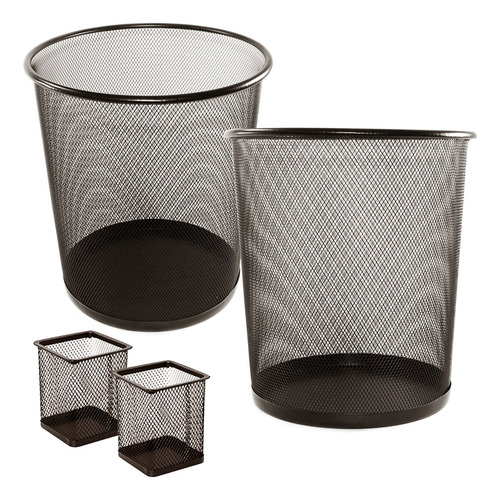
The image size is (500, 500). In order to click on trash cans in this screenshot , I will do pos(275,239), pos(166,182), pos(147,395), pos(61,397).